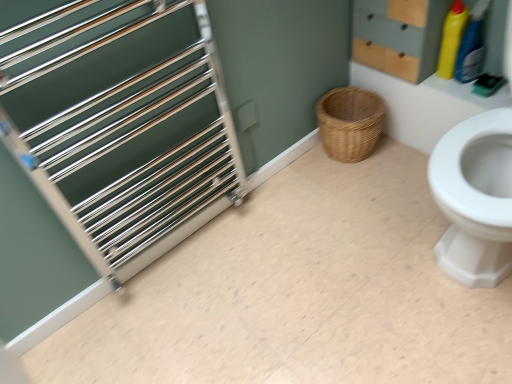
Image resolution: width=512 pixels, height=384 pixels. What are the coordinates of `free location to the left of yellow plastic bottle at upper right, placed as the second cleaning product when sorted from right to left` in the screenshot? It's located at (418, 77).